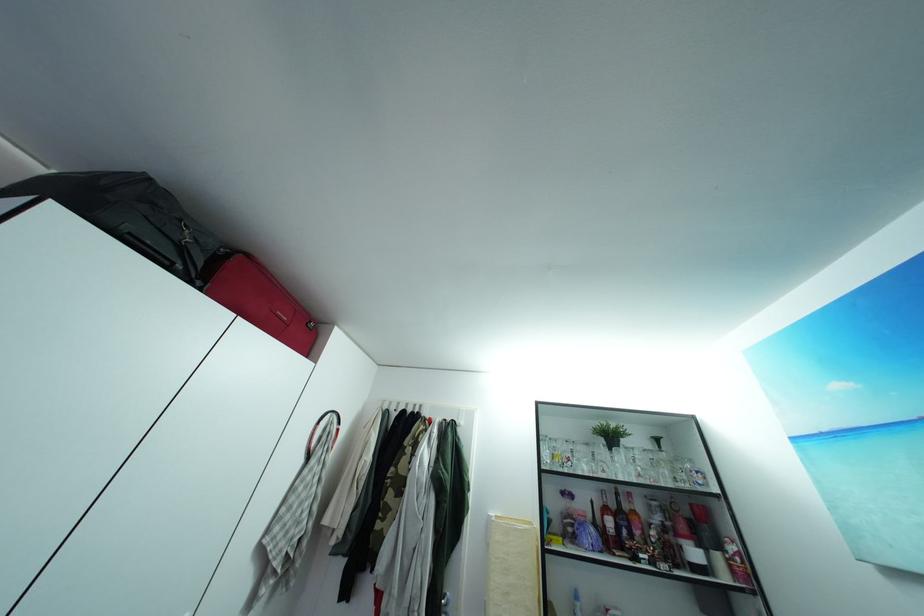
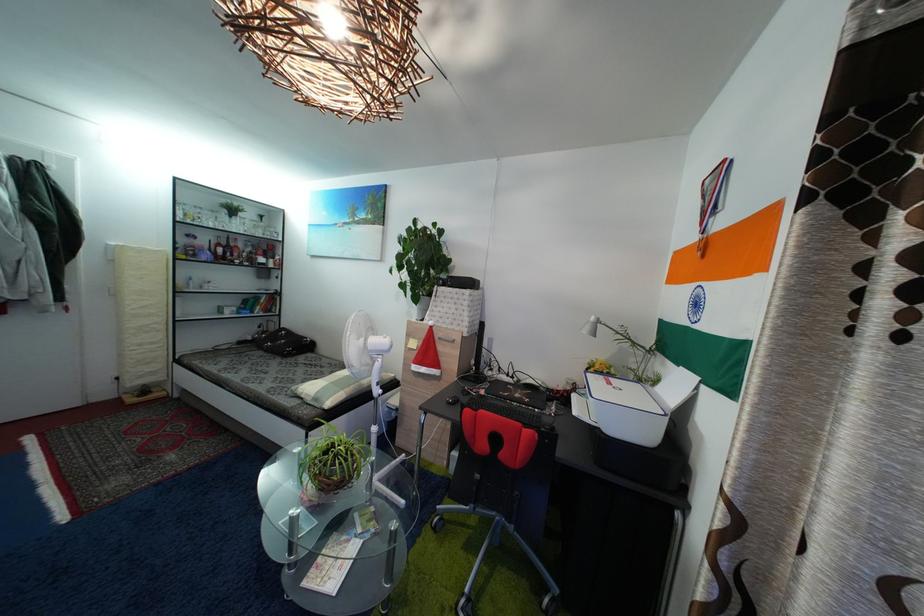
Where in the second image is the point corresponding to point 592,506 from the first image?

(213, 246)